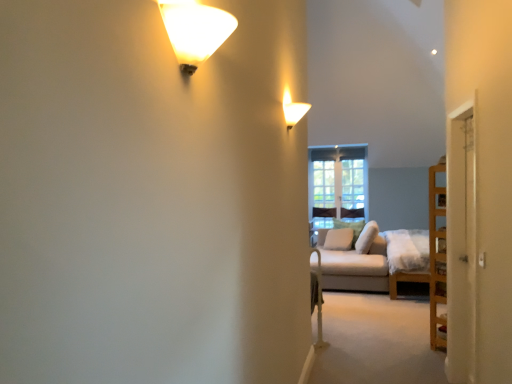
Question: Can you confirm if white soft pillow at center, the first pillow viewed from the back, is bigger than white fabric pillow at center, which is counted as the third pillow, starting from the back?

Choices:
 (A) yes
 (B) no

Answer: (B)

Question: From the image's perspective, is white soft pillow at center, the first pillow viewed from the back, located beneath white fabric pillow at center, which is counted as the third pillow, starting from the back?

Choices:
 (A) no
 (B) yes

Answer: (A)

Question: Can you confirm if white soft pillow at center, marked as the third pillow in a front-to-back arrangement, is taller than white fabric pillow at center, the first pillow positioned from the front?

Choices:
 (A) no
 (B) yes

Answer: (B)

Question: Can you confirm if white soft pillow at center, marked as the third pillow in a front-to-back arrangement, is smaller than white fabric pillow at center, the first pillow positioned from the front?

Choices:
 (A) yes
 (B) no

Answer: (A)

Question: Is white soft pillow at center, the first pillow viewed from the back, thinner than white fabric pillow at center, which is counted as the third pillow, starting from the back?

Choices:
 (A) no
 (B) yes

Answer: (B)

Question: Is white soft pillow at center, positioned as the second pillow in back-to-front order, wider or thinner than matte white wall sconce at upper center, placed as the 2th lamp when sorted from left to right?

Choices:
 (A) thin
 (B) wide

Answer: (B)

Question: Looking at the image, does white soft pillow at center, positioned as the second pillow in back-to-front order, seem bigger or smaller compared to matte white wall sconce at upper center, placed as the 2th lamp when sorted from left to right?

Choices:
 (A) small
 (B) big

Answer: (B)

Question: Visually, is white soft pillow at center, positioned as the second pillow in back-to-front order, positioned to the left or to the right of matte white wall sconce at upper center, positioned as the first lamp in right-to-left order?

Choices:
 (A) right
 (B) left

Answer: (A)

Question: In terms of height, does white soft pillow at center, the 2th pillow when ordered from front to back, look taller or shorter compared to matte white wall sconce at upper center, which is counted as the second lamp, starting from the front?

Choices:
 (A) short
 (B) tall

Answer: (B)

Question: In terms of width, does matte white wall sconce at upper center, positioned as the first lamp in right-to-left order, look wider or thinner when compared to clear glass window at center?

Choices:
 (A) thin
 (B) wide

Answer: (B)

Question: From a real-world perspective, relative to clear glass window at center, is matte white wall sconce at upper center, positioned as the first lamp in right-to-left order, vertically above or below?

Choices:
 (A) above
 (B) below

Answer: (A)

Question: From the image's perspective, is matte white wall sconce at upper center, placed as the first lamp when sorted from back to front, positioned above or below clear glass window at center?

Choices:
 (A) above
 (B) below

Answer: (A)

Question: Considering their positions, is matte white wall sconce at upper center, placed as the first lamp when sorted from back to front, located in front of or behind clear glass window at center?

Choices:
 (A) front
 (B) behind

Answer: (A)

Question: Looking at the image, does clear glass window at center seem bigger or smaller compared to matte white wall sconce at upper center, placed as the 2th lamp when sorted from left to right?

Choices:
 (A) small
 (B) big

Answer: (B)

Question: Considering their positions, is clear glass window at center located in front of or behind matte white wall sconce at upper center, placed as the 2th lamp when sorted from left to right?

Choices:
 (A) behind
 (B) front

Answer: (A)